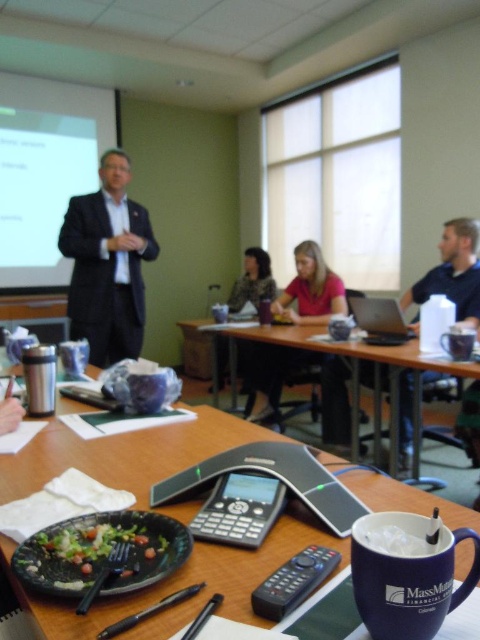
Question: Does matte pink shirt at center appear on the left side of patterned fabric shirt at center?

Choices:
 (A) no
 (B) yes

Answer: (A)

Question: Among these objects, which one is nearest to the camera?

Choices:
 (A) smooth plastic conference table at center
 (B) green leafy salad at center
 (C) blue ceramic mug at lower right

Answer: (C)

Question: Observing the image, what is the correct spatial positioning of black suit at center in reference to blue fabric shirt at right?

Choices:
 (A) below
 (B) above

Answer: (B)

Question: Which object is farther from the camera taking this photo?

Choices:
 (A) blue fabric shirt at right
 (B) blue ceramic mug at lower right

Answer: (A)

Question: In this image, where is green leafy salad at center located relative to blue fabric shirt at right?

Choices:
 (A) left
 (B) right

Answer: (A)

Question: Which of the following is the closest to the observer?

Choices:
 (A) (403, 404)
 (B) (226, 364)

Answer: (A)